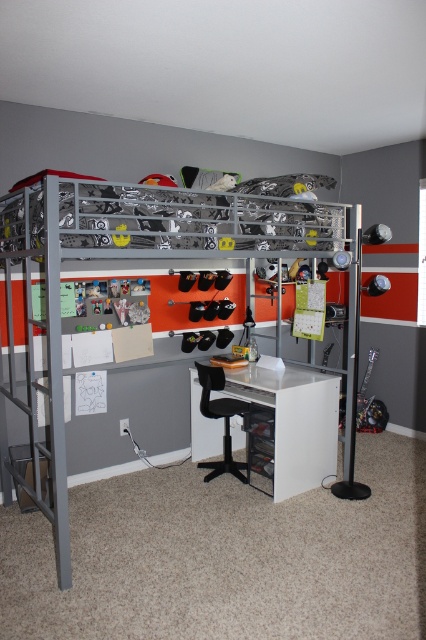
Question: Which point appears farthest from the camera in this image?

Choices:
 (A) (276, 380)
 (B) (304, 227)
 (C) (206, 412)

Answer: (C)

Question: Based on their relative distances, which object is farther from the metallic silver bunk bed at upper center?

Choices:
 (A) black plastic stool at lower center
 (B) white glossy desk at center

Answer: (A)

Question: Which point is closer to the camera?

Choices:
 (A) (299, 428)
 (B) (150, 241)

Answer: (B)

Question: Can you confirm if metallic silver bunk bed at upper center is smaller than black plastic stool at lower center?

Choices:
 (A) yes
 (B) no

Answer: (B)

Question: Does metallic silver bunk bed at upper center lie behind black plastic stool at lower center?

Choices:
 (A) no
 (B) yes

Answer: (A)

Question: Can you confirm if metallic silver bunk bed at upper center is wider than black plastic stool at lower center?

Choices:
 (A) no
 (B) yes

Answer: (B)